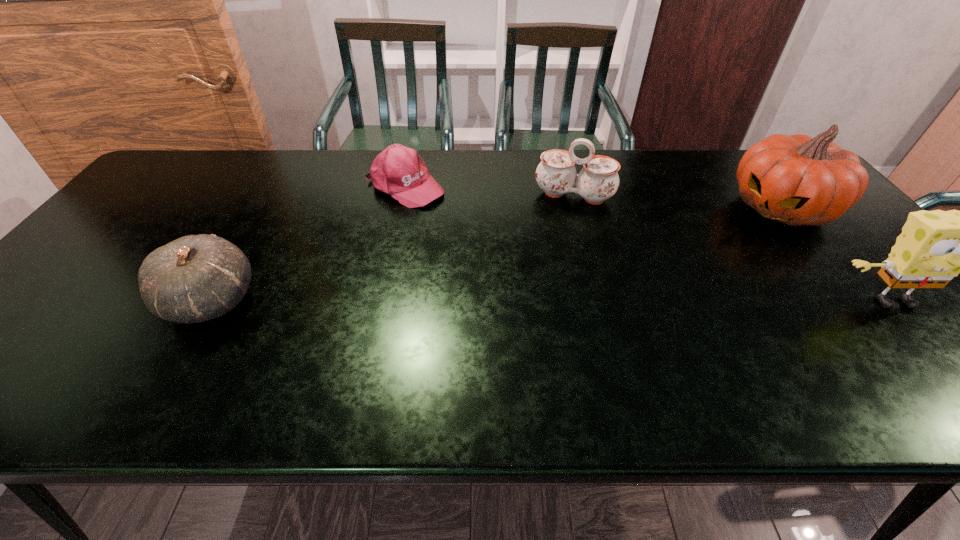
Locate an element on the screen. Image resolution: width=960 pixels, height=540 pixels. object that stands as the third closest to the sponge is located at coordinates (398, 171).

Select which object is the second closest to the third object from right to left. Please provide its 2D coordinates. Your answer should be formatted as a tuple, i.e. [(x, y)], where the tuple contains the x and y coordinates of a point satisfying the conditions above.

[(797, 180)]

This screenshot has width=960, height=540. Find the location of `free space in the image that satisfies the following two spatial constraints: 1. on the back side of the pumpkin; 2. on the right side of the gourd`. free space in the image that satisfies the following two spatial constraints: 1. on the back side of the pumpkin; 2. on the right side of the gourd is located at coordinates (265, 208).

Image resolution: width=960 pixels, height=540 pixels. In order to click on free spot that satisfies the following two spatial constraints: 1. on the front side of the pumpkin; 2. on the right side of the third object from left to right in this screenshot , I will do `click(577, 208)`.